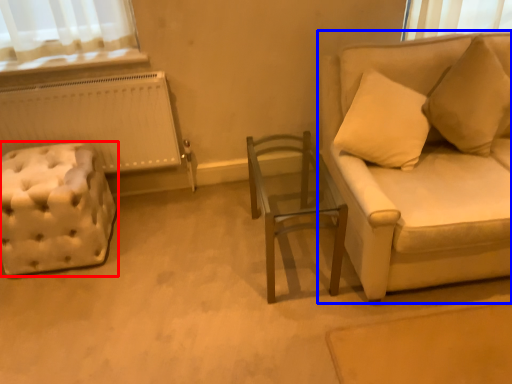
Question: Which object appears farthest to the camera in this image, furniture (highlighted by a red box) or studio couch (highlighted by a blue box)?

Choices:
 (A) furniture
 (B) studio couch

Answer: (A)